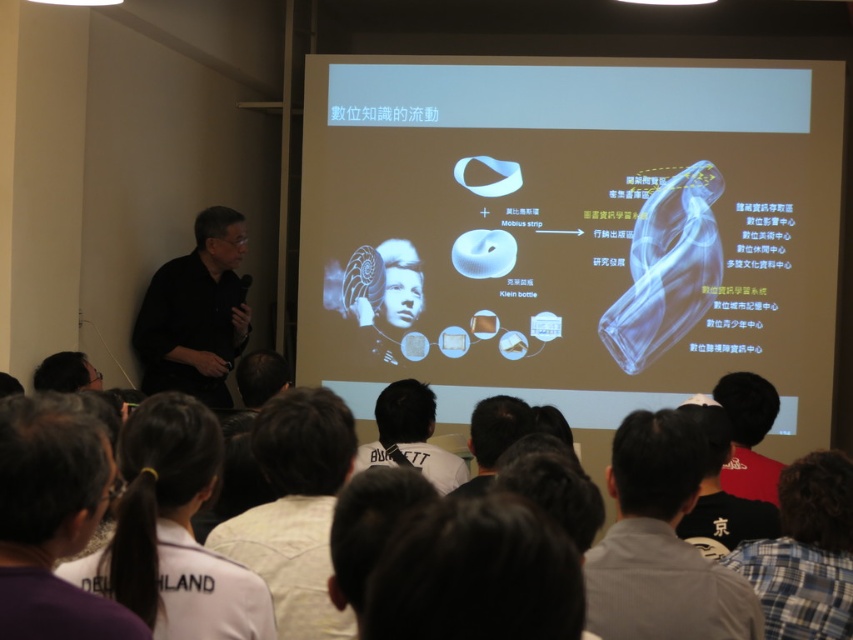
Does white shirt at lower center have a greater height compared to plaid shirt at lower right?

Yes.

Which is below, white shirt at lower center or plaid shirt at lower right?

plaid shirt at lower right is lower down.

Does point (309, 536) lie in front of point (773, 611)?

Yes, point (309, 536) is in front of point (773, 611).

Identify the location of white shirt at lower center. This screenshot has height=640, width=853. (294, 509).

Between point (635, 625) and point (224, 243), which one is positioned behind?

Positioned behind is point (224, 243).

Find the location of a particular element. The height and width of the screenshot is (640, 853). white shirt at lower right is located at coordinates pyautogui.click(x=660, y=545).

Where is `white shirt at lower right`? white shirt at lower right is located at coordinates (660, 545).

Can you confirm if white fabric at lower left is positioned below dark hair at center?

No, white fabric at lower left is not below dark hair at center.

Who is positioned more to the right, white fabric at lower left or dark hair at center?

dark hair at center

Is point (187, 502) behind point (407, 637)?

Yes, point (187, 502) is behind point (407, 637).

Identify the location of white fabric at lower left. This screenshot has width=853, height=640. (172, 532).